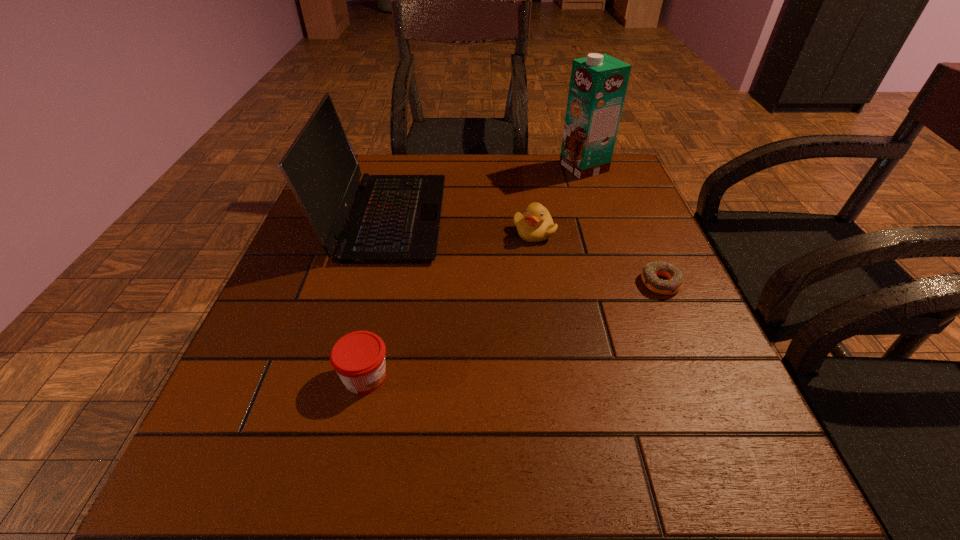
This screenshot has width=960, height=540. I want to click on vacant area that lies between the laptop computer and the nearest object, so click(x=375, y=297).

The image size is (960, 540). In order to click on free space between the third object from left to right and the laptop computer in this screenshot , I will do `click(460, 225)`.

Find the location of a particular element. This screenshot has width=960, height=540. free point between the jam and the doughnut is located at coordinates (513, 330).

At what (x,y) coordinates should I click in order to perform the action: click on object that is the fourth closest to the jam. Please return your answer as a coordinate pair (x, y). The width and height of the screenshot is (960, 540). Looking at the image, I should click on (598, 83).

Locate which object is the closest to the shortest object. Please provide its 2D coordinates. Your answer should be formatted as a tuple, i.e. [(x, y)], where the tuple contains the x and y coordinates of a point satisfying the conditions above.

[(535, 225)]

The image size is (960, 540). I want to click on free spot that satisfies the following two spatial constraints: 1. on the screen of the laptop computer; 2. on the back side of the second nearest object, so click(x=369, y=283).

At what (x,y) coordinates should I click in order to perform the action: click on free region that satisfies the following two spatial constraints: 1. on the front side of the carton; 2. on the label side of the jam. Please return your answer as a coordinate pair (x, y). This screenshot has width=960, height=540. Looking at the image, I should click on (656, 376).

I want to click on vacant space that satisfies the following two spatial constraints: 1. on the front side of the doughnut; 2. on the left side of the farthest object, so click(x=623, y=283).